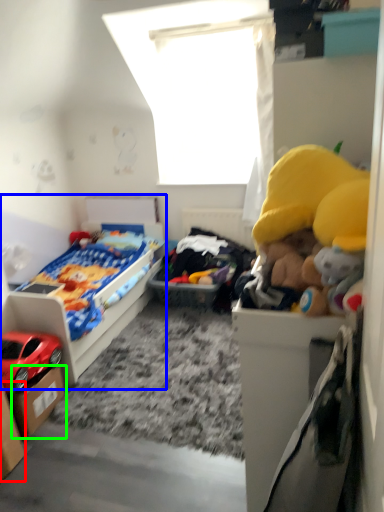
Question: Considering the real-world distances, which object is farthest from storage box (highlighted by a red box)? bed (highlighted by a blue box) or storage box (highlighted by a green box)?

Choices:
 (A) bed
 (B) storage box

Answer: (A)